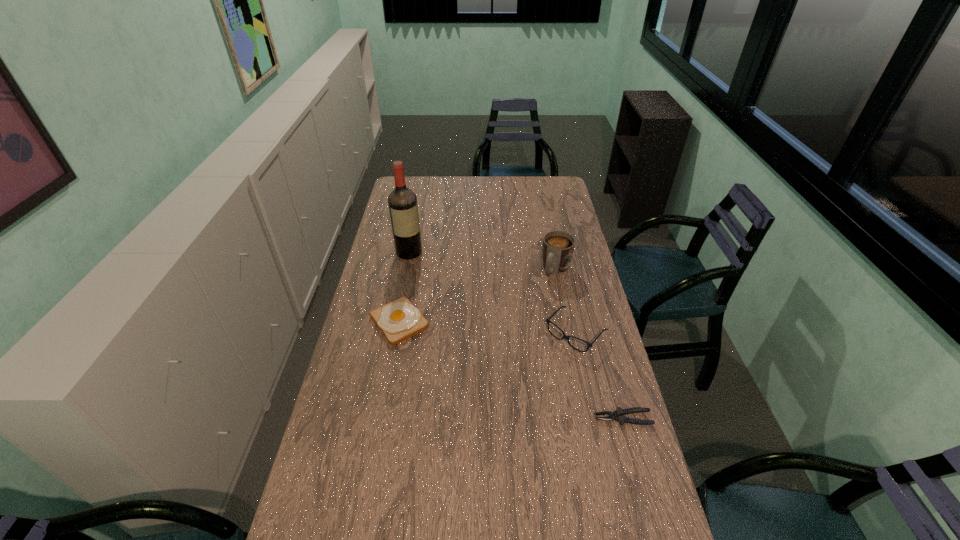
Locate which object is the second closest to the third tallest object. Please provide its 2D coordinates. Your answer should be formatted as a tuple, i.e. [(x, y)], where the tuple contains the x and y coordinates of a point satisfying the conditions above.

[(618, 415)]

Where is `vacant space that satisfies the following two spatial constraints: 1. on the front side of the nearest object; 2. at the gripping part of the toast`? Image resolution: width=960 pixels, height=540 pixels. vacant space that satisfies the following two spatial constraints: 1. on the front side of the nearest object; 2. at the gripping part of the toast is located at coordinates (381, 418).

At what (x,y) coordinates should I click in order to perform the action: click on free location that satisfies the following two spatial constraints: 1. on the front side of the tallest object; 2. at the gripping part of the shortest object. Please return your answer as a coordinate pair (x, y). The height and width of the screenshot is (540, 960). Looking at the image, I should click on (376, 418).

Find the location of `vacant space that satisfies the following two spatial constraints: 1. on the front side of the spectacles; 2. on the left side of the second shortest object`. vacant space that satisfies the following two spatial constraints: 1. on the front side of the spectacles; 2. on the left side of the second shortest object is located at coordinates (396, 333).

You are a GUI agent. You are given a task and a screenshot of the screen. Output one action in this format:
    pyautogui.click(x=<x>, y=<y>)
    Task: Click on the free region that satisfies the following two spatial constraints: 1. on the front side of the mug; 2. on the right side of the liquor
    Image resolution: width=960 pixels, height=540 pixels.
    Given the screenshot: What is the action you would take?
    pyautogui.click(x=406, y=269)